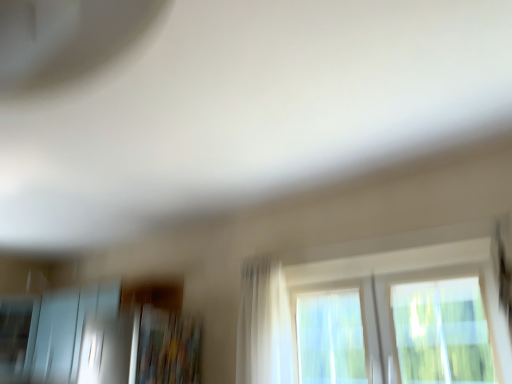
Question: Is the surface of frosted glass screen door at lower left in direct contact with white sheer curtain at center?

Choices:
 (A) no
 (B) yes

Answer: (A)

Question: Considering the relative sizes of frosted glass screen door at lower left and white sheer curtain at center in the image provided, is frosted glass screen door at lower left thinner than white sheer curtain at center?

Choices:
 (A) yes
 (B) no

Answer: (B)

Question: Is frosted glass screen door at lower left taller than white sheer curtain at center?

Choices:
 (A) yes
 (B) no

Answer: (B)

Question: Is frosted glass screen door at lower left at the right side of white sheer curtain at center?

Choices:
 (A) yes
 (B) no

Answer: (B)

Question: Is frosted glass screen door at lower left facing away from white sheer curtain at center?

Choices:
 (A) no
 (B) yes

Answer: (A)

Question: From a real-world perspective, is white sheer curtain at center physically located above or below frosted glass screen door at lower left?

Choices:
 (A) above
 (B) below

Answer: (A)

Question: From the image's perspective, relative to frosted glass screen door at lower left, is white sheer curtain at center above or below?

Choices:
 (A) below
 (B) above

Answer: (B)

Question: Is point (263, 271) closer or farther from the camera than point (53, 347)?

Choices:
 (A) closer
 (B) farther

Answer: (A)

Question: Would you say white sheer curtain at center is inside or outside frosted glass screen door at lower left?

Choices:
 (A) inside
 (B) outside

Answer: (B)

Question: From the image's perspective, is white sheer curtain at center positioned above or below transparent glass window at center?

Choices:
 (A) below
 (B) above

Answer: (B)

Question: Does point 265,274 appear closer or farther from the camera than point 498,337?

Choices:
 (A) closer
 (B) farther

Answer: (B)

Question: In the image, is white sheer curtain at center positioned in front of or behind transparent glass window at center?

Choices:
 (A) behind
 (B) front

Answer: (A)

Question: From their relative heights in the image, would you say white sheer curtain at center is taller or shorter than transparent glass window at center?

Choices:
 (A) tall
 (B) short

Answer: (A)

Question: Based on their positions, is frosted glass screen door at lower left located to the left or right of transparent glass window at center?

Choices:
 (A) right
 (B) left

Answer: (B)

Question: In terms of height, does frosted glass screen door at lower left look taller or shorter compared to transparent glass window at center?

Choices:
 (A) tall
 (B) short

Answer: (A)